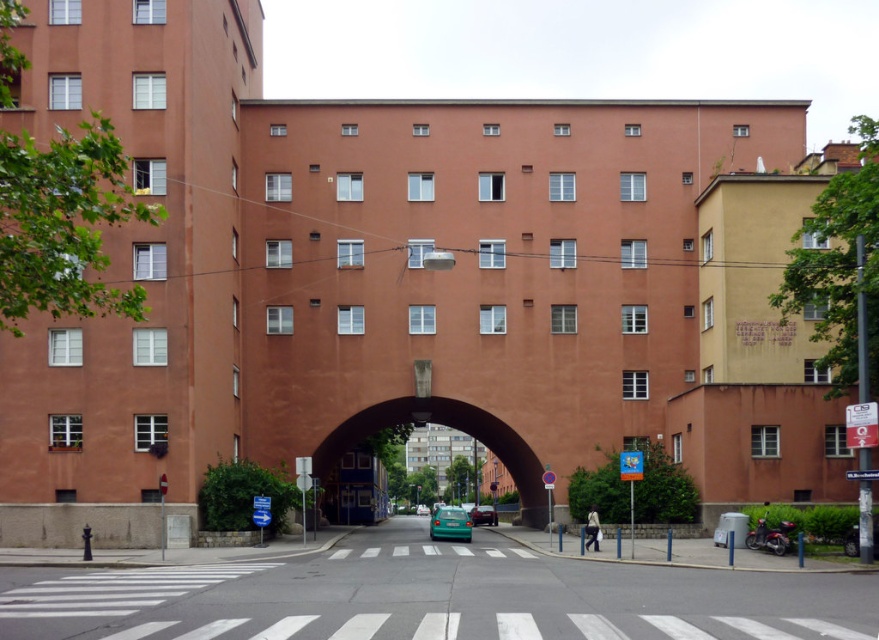
How distant is teal matte car at center from teal glossy car at center?

57.23 meters

Is point (496, 516) positioned before point (422, 512)?

Yes.

Who is more distant from viewer, (476,518) or (419,515)?

The point (419,515) is behind.

Identify the location of teal matte car at center. The width and height of the screenshot is (879, 640). tap(483, 515).

Does point (463, 536) come behind point (429, 512)?

No, it is not.

Does green matte car at center come in front of teal glossy car at center?

Yes, green matte car at center is closer to the viewer.

Is point (442, 532) behind point (427, 513)?

That is False.

Locate an element on the screen. green matte car at center is located at coordinates (449, 524).

Can you confirm if green matte car at center is positioned below teal matte car at center?

No.

Describe the element at coordinates (449, 524) in the screenshot. I see `green matte car at center` at that location.

Which is in front, point (440, 534) or point (473, 518)?

Positioned in front is point (440, 534).

Where is `green matte car at center`? This screenshot has height=640, width=879. green matte car at center is located at coordinates (449, 524).